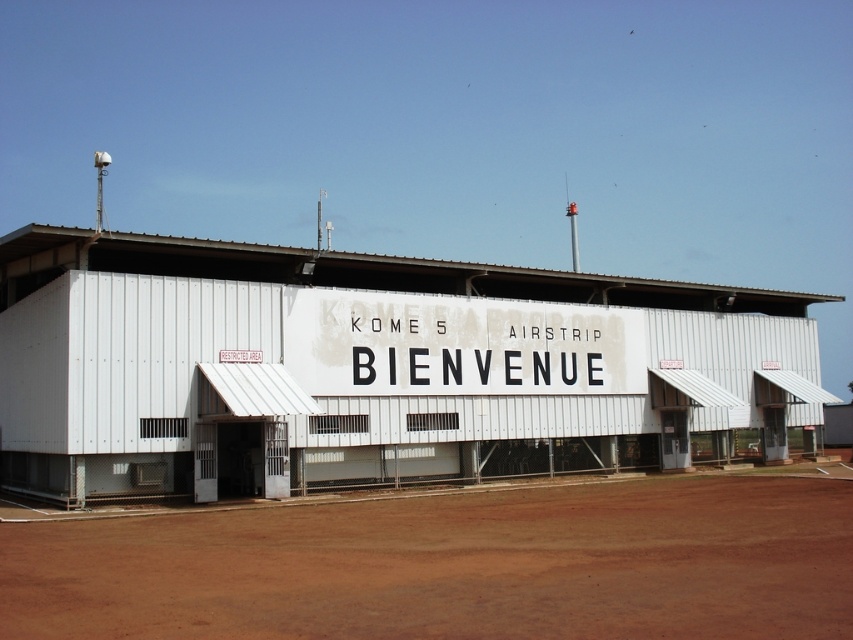
Question: Which point appears farthest from the camera in this image?

Choices:
 (A) (531, 618)
 (B) (49, 236)

Answer: (B)

Question: From the image, what is the correct spatial relationship of white corrugated metal shed at center in relation to brown dirt field at lower center?

Choices:
 (A) below
 (B) above

Answer: (B)

Question: Which object is farther from the camera taking this photo?

Choices:
 (A) white corrugated metal shed at center
 (B) brown dirt field at lower center

Answer: (A)

Question: Does white corrugated metal shed at center appear on the right side of brown dirt field at lower center?

Choices:
 (A) yes
 (B) no

Answer: (A)

Question: Which object appears closest to the camera in this image?

Choices:
 (A) brown dirt field at lower center
 (B) white corrugated metal shed at center

Answer: (A)

Question: Does white corrugated metal shed at center come in front of brown dirt field at lower center?

Choices:
 (A) no
 (B) yes

Answer: (A)